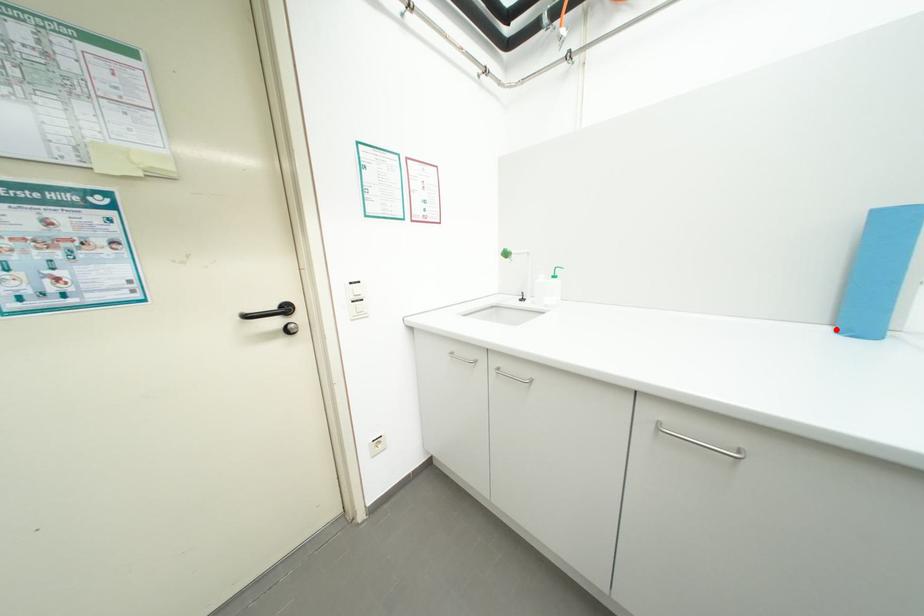
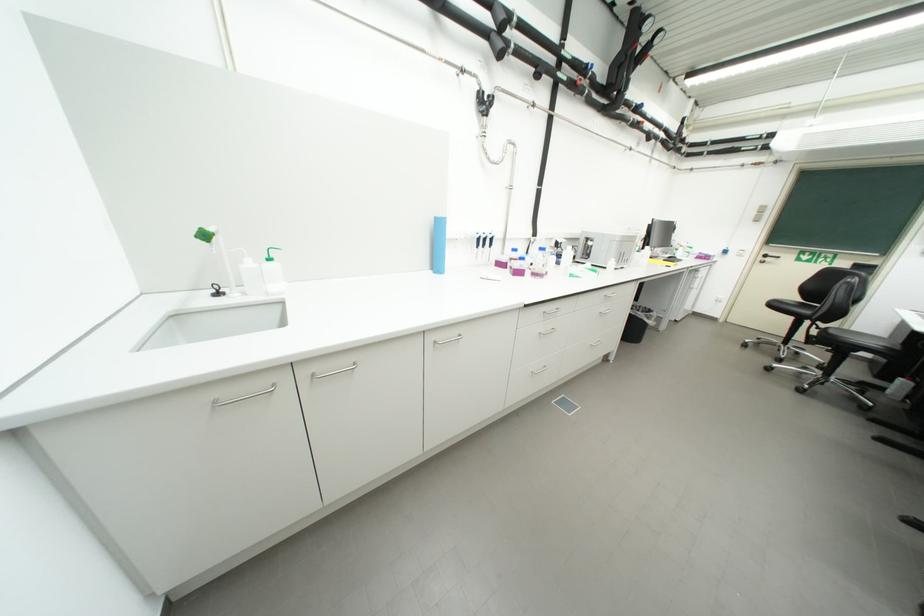
Question: I am providing you with two images of the same scene from different viewpoints. A red point is marked on the first image. Is the red point's position out of view in image 2?

Choices:
 (A) Yes
 (B) No

Answer: (B)